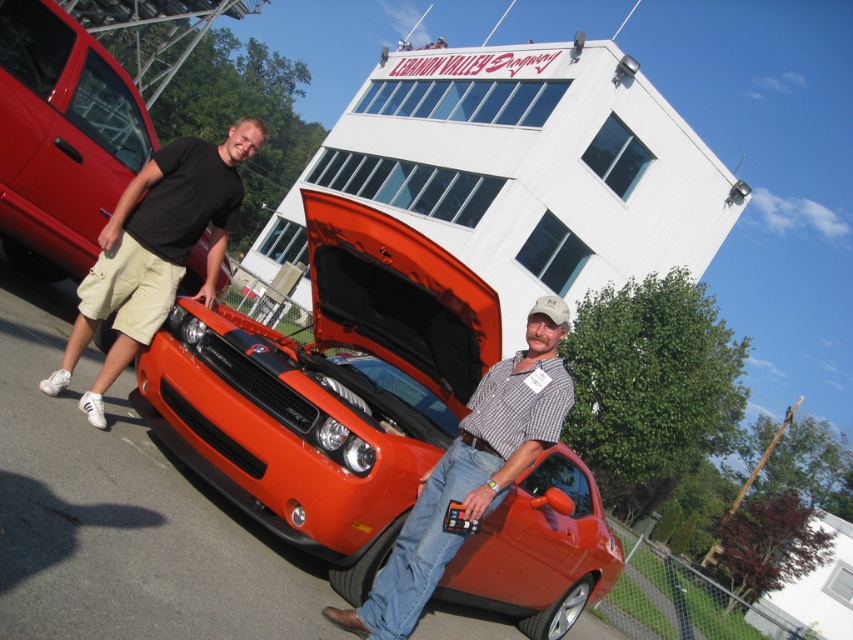
Question: Is matte black car at left in front of black cotton t-shirt at left?

Choices:
 (A) no
 (B) yes

Answer: (A)

Question: Is the position of shiny orange car at center more distant than that of black cotton t-shirt at left?

Choices:
 (A) yes
 (B) no

Answer: (B)

Question: Based on their relative distances, which object is nearer to the checkered fabric shirt at center?

Choices:
 (A) matte black car at left
 (B) shiny orange car at center
 (C) black cotton t-shirt at left

Answer: (B)

Question: Which point is farther to the camera?

Choices:
 (A) black cotton t-shirt at left
 (B) shiny orange car at center
 (C) checkered fabric shirt at center

Answer: (A)

Question: Considering the relative positions of matte black car at left and black cotton t-shirt at left in the image provided, where is matte black car at left located with respect to black cotton t-shirt at left?

Choices:
 (A) left
 (B) right

Answer: (A)

Question: Which point is farther to the camera?

Choices:
 (A) (404, 528)
 (B) (49, 241)
 (C) (112, 342)

Answer: (C)